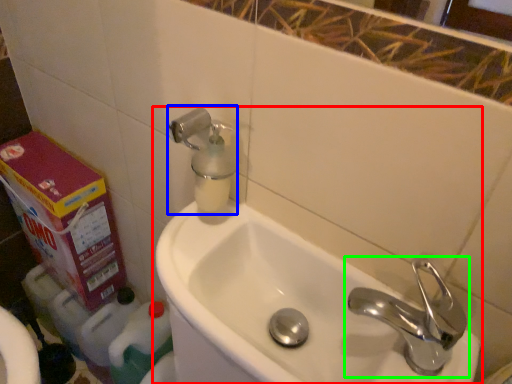
Question: Which object is the farthest from sink (highlighted by a red box)? Choose among these: soap dispenser (highlighted by a blue box) or tap (highlighted by a green box).

Choices:
 (A) soap dispenser
 (B) tap

Answer: (A)